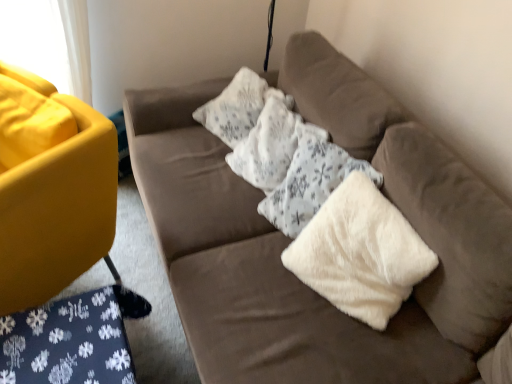
Question: Is white fluffy pillow at center inside matte yellow couch at left, marked as the 2th studio couch in a right-to-left arrangement?

Choices:
 (A) yes
 (B) no

Answer: (B)

Question: Does matte yellow couch at left, marked as the 2th studio couch in a right-to-left arrangement, touch white fluffy pillow at center?

Choices:
 (A) yes
 (B) no

Answer: (B)

Question: Considering the relative positions of matte yellow couch at left, marked as the 2th studio couch in a right-to-left arrangement, and white fluffy pillow at center in the image provided, is matte yellow couch at left, marked as the 2th studio couch in a right-to-left arrangement, to the right of white fluffy pillow at center from the viewer's perspective?

Choices:
 (A) no
 (B) yes

Answer: (A)

Question: Considering the relative sizes of matte yellow couch at left, which is the 1th studio couch from left to right, and white fluffy pillow at center in the image provided, is matte yellow couch at left, which is the 1th studio couch from left to right, wider than white fluffy pillow at center?

Choices:
 (A) yes
 (B) no

Answer: (A)

Question: Can you confirm if matte yellow couch at left, marked as the 2th studio couch in a right-to-left arrangement, is thinner than white fluffy pillow at center?

Choices:
 (A) yes
 (B) no

Answer: (B)

Question: Considering the positions of white fluffy pillow at center and velvet brown couch at center, which is the 2th studio couch from left to right, in the image, is white fluffy pillow at center bigger or smaller than velvet brown couch at center, which is the 2th studio couch from left to right,?

Choices:
 (A) big
 (B) small

Answer: (B)

Question: From their relative heights in the image, would you say white fluffy pillow at center is taller or shorter than velvet brown couch at center, which is the 2th studio couch from left to right?

Choices:
 (A) short
 (B) tall

Answer: (A)

Question: Does point (343, 292) appear closer or farther from the camera than point (477, 208)?

Choices:
 (A) farther
 (B) closer

Answer: (A)

Question: Is white fluffy pillow at center inside the boundaries of velvet brown couch at center, arranged as the 1th studio couch when viewed from the right, or outside?

Choices:
 (A) outside
 (B) inside

Answer: (B)

Question: Choose the correct answer: Is velvet brown couch at center, which is the 2th studio couch from left to right, inside white fluffy pillow at center or outside it?

Choices:
 (A) outside
 (B) inside

Answer: (A)

Question: From a real-world perspective, is velvet brown couch at center, arranged as the 1th studio couch when viewed from the right, physically located above or below white fluffy pillow at center?

Choices:
 (A) above
 (B) below

Answer: (B)

Question: In terms of width, does velvet brown couch at center, arranged as the 1th studio couch when viewed from the right, look wider or thinner when compared to white fluffy pillow at center?

Choices:
 (A) thin
 (B) wide

Answer: (B)

Question: From the image's perspective, relative to white fluffy pillow at center, is velvet brown couch at center, arranged as the 1th studio couch when viewed from the right, above or below?

Choices:
 (A) above
 (B) below

Answer: (A)

Question: In terms of width, does velvet brown couch at center, arranged as the 1th studio couch when viewed from the right, look wider or thinner when compared to white fluffy pillow at center?

Choices:
 (A) thin
 (B) wide

Answer: (B)

Question: Considering their positions, is velvet brown couch at center, arranged as the 1th studio couch when viewed from the right, located in front of or behind white fluffy pillow at center?

Choices:
 (A) behind
 (B) front

Answer: (B)